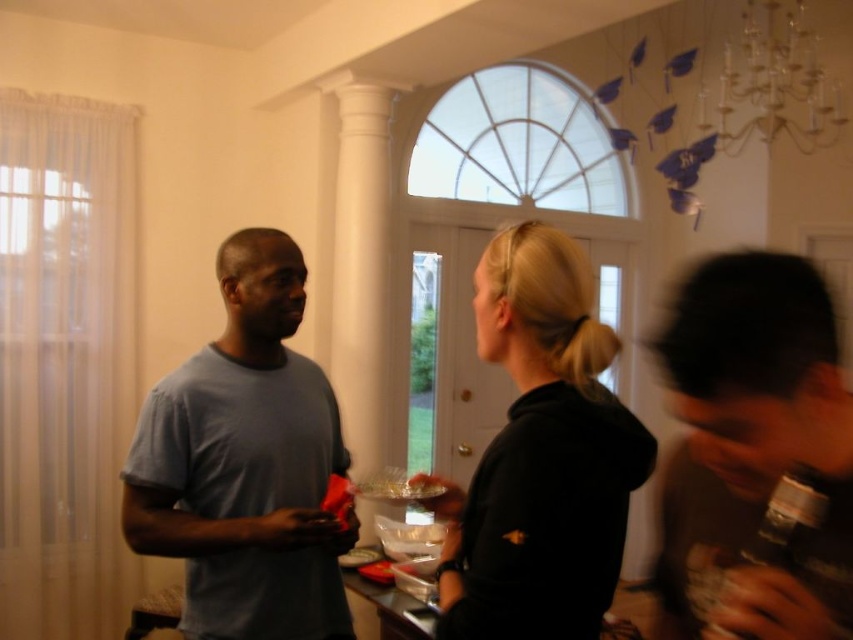
Question: Is light blue t-shirt at center thinner than matte gray t-shirt at left?

Choices:
 (A) no
 (B) yes

Answer: (A)

Question: Observing the image, what is the correct spatial positioning of matte gray t-shirt at left in reference to black matte hoodie at center?

Choices:
 (A) above
 (B) below

Answer: (B)

Question: Which object is positioned farthest from the dark gray matte shirt at right?

Choices:
 (A) matte gray t-shirt at left
 (B) light blue t-shirt at center

Answer: (A)

Question: Estimate the real-world distances between objects in this image. Which object is closer to the metallic glass chandelier at upper right?

Choices:
 (A) dark gray matte shirt at right
 (B) light blue t-shirt at center
 (C) matte gray t-shirt at left

Answer: (C)

Question: Is the position of light blue t-shirt at center less distant than that of metallic glass chandelier at upper right?

Choices:
 (A) no
 (B) yes

Answer: (B)

Question: Which object appears farthest from the camera in this image?

Choices:
 (A) dark gray matte shirt at right
 (B) metallic glass chandelier at upper right
 (C) matte gray t-shirt at left

Answer: (B)